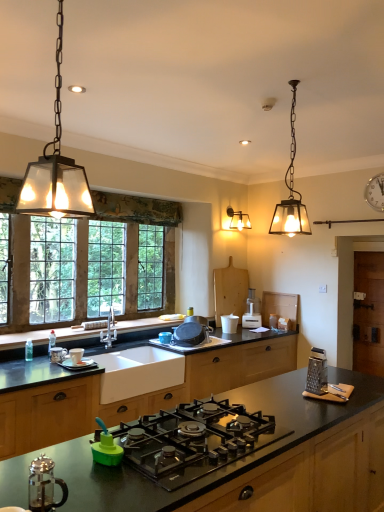
Locate an element on the screen. The image size is (384, 512). free space in front of green plastic bottle at lower center, which is the 2th appliance in left-to-right order is located at coordinates (103, 484).